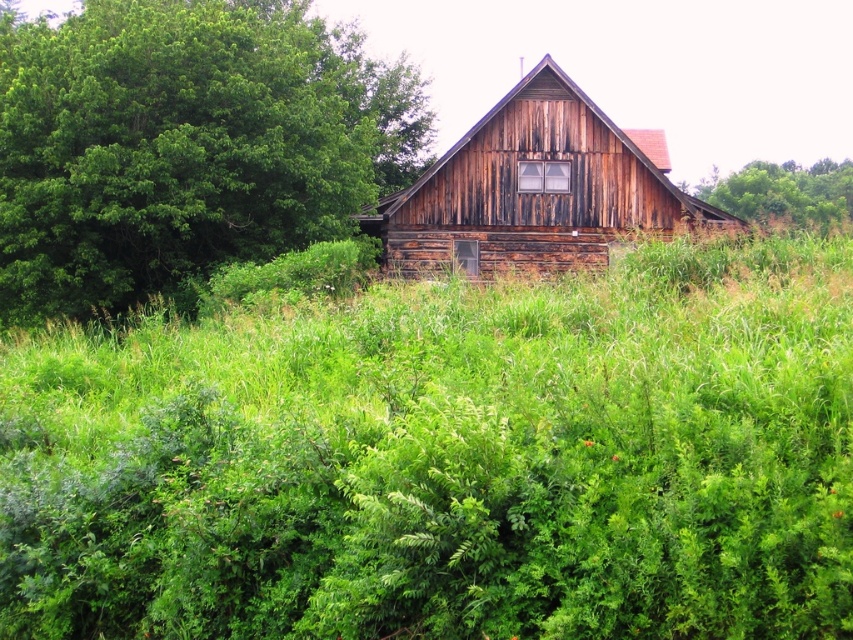
Does green leafy grass at center have a larger size compared to green leafy tree at upper left?

Incorrect, green leafy grass at center is not larger than green leafy tree at upper left.

What do you see at coordinates (450, 461) in the screenshot? I see `green leafy grass at center` at bounding box center [450, 461].

At what (x,y) coordinates should I click in order to perform the action: click on green leafy grass at center. Please return your answer as a coordinate pair (x, y). This screenshot has width=853, height=640. Looking at the image, I should click on (450, 461).

Is point (381, 257) in front of point (821, 192)?

Yes.

Which is more to the right, rustic wooden barn at center or green leafy tree at upper right?

green leafy tree at upper right is more to the right.

Which is behind, point (506, 214) or point (849, 196)?

Positioned behind is point (849, 196).

Identify the location of rustic wooden barn at center. (534, 189).

Between green leafy grass at center and green leafy tree at upper right, which one is positioned lower?

green leafy grass at center is lower down.

Is green leafy grass at center shorter than green leafy tree at upper right?

Yes.

Locate an element on the screen. green leafy grass at center is located at coordinates (x=450, y=461).